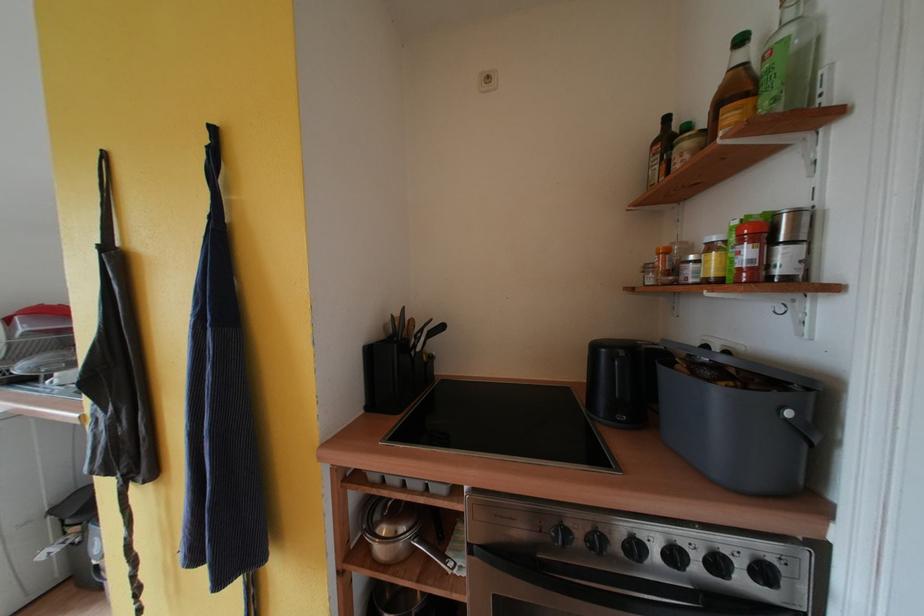
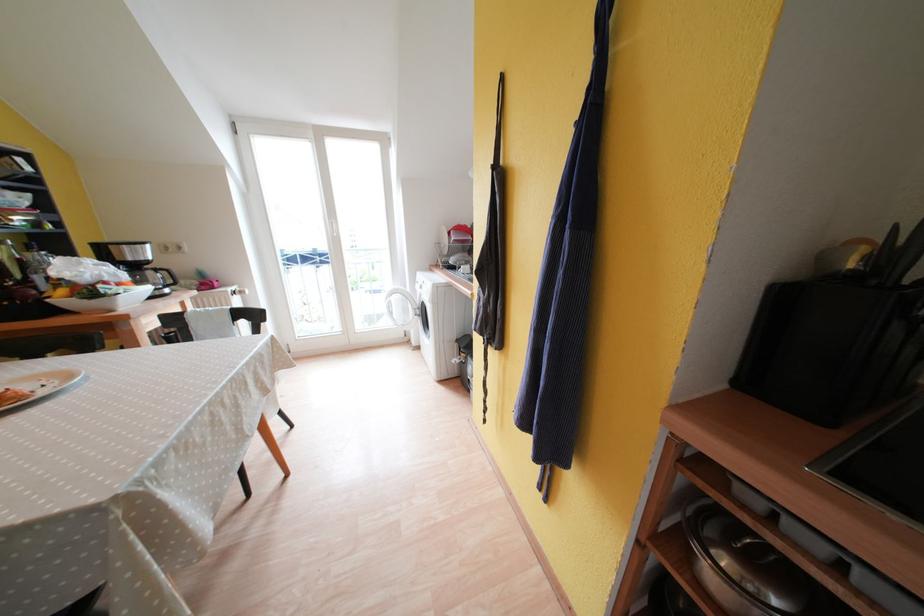
How did the camera likely rotate?

The camera's rotation is toward left-down.